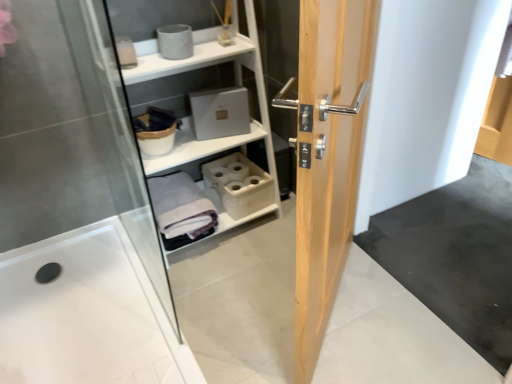
Question: Considering the relative sizes of white matte shelf at upper center and light wood door at center in the image provided, is white matte shelf at upper center bigger than light wood door at center?

Choices:
 (A) yes
 (B) no

Answer: (A)

Question: From the image's perspective, is white matte shelf at upper center located beneath light wood door at center?

Choices:
 (A) yes
 (B) no

Answer: (B)

Question: Can you confirm if white matte shelf at upper center is taller than light wood door at center?

Choices:
 (A) yes
 (B) no

Answer: (B)

Question: Does white matte shelf at upper center have a smaller size compared to light wood door at center?

Choices:
 (A) yes
 (B) no

Answer: (B)

Question: Can you confirm if white matte shelf at upper center is positioned to the left of light wood door at center?

Choices:
 (A) no
 (B) yes

Answer: (B)

Question: Is transparent glass shower door at left in front of or behind light wood door at center in the image?

Choices:
 (A) front
 (B) behind

Answer: (B)

Question: Is point (0, 173) closer or farther from the camera than point (368, 13)?

Choices:
 (A) closer
 (B) farther

Answer: (B)

Question: Would you say transparent glass shower door at left is to the left or to the right of light wood door at center in the picture?

Choices:
 (A) left
 (B) right

Answer: (A)

Question: Considering the positions of transparent glass shower door at left and light wood door at center in the image, is transparent glass shower door at left taller or shorter than light wood door at center?

Choices:
 (A) tall
 (B) short

Answer: (B)

Question: From the image's perspective, is transparent glass shower door at left above or below white matte shelf at upper center?

Choices:
 (A) below
 (B) above

Answer: (A)

Question: In terms of width, does transparent glass shower door at left look wider or thinner when compared to white matte shelf at upper center?

Choices:
 (A) wide
 (B) thin

Answer: (A)

Question: Does point (66, 3) appear closer or farther from the camera than point (153, 52)?

Choices:
 (A) farther
 (B) closer

Answer: (B)

Question: Based on their sizes in the image, would you say transparent glass shower door at left is bigger or smaller than white matte shelf at upper center?

Choices:
 (A) big
 (B) small

Answer: (B)

Question: Considering the positions of point (181, 218) and point (38, 54), is point (181, 218) closer or farther from the camera than point (38, 54)?

Choices:
 (A) farther
 (B) closer

Answer: (A)

Question: Do you think gray cotton bath towel at center is within transparent glass shower door at left, or outside of it?

Choices:
 (A) outside
 (B) inside

Answer: (A)